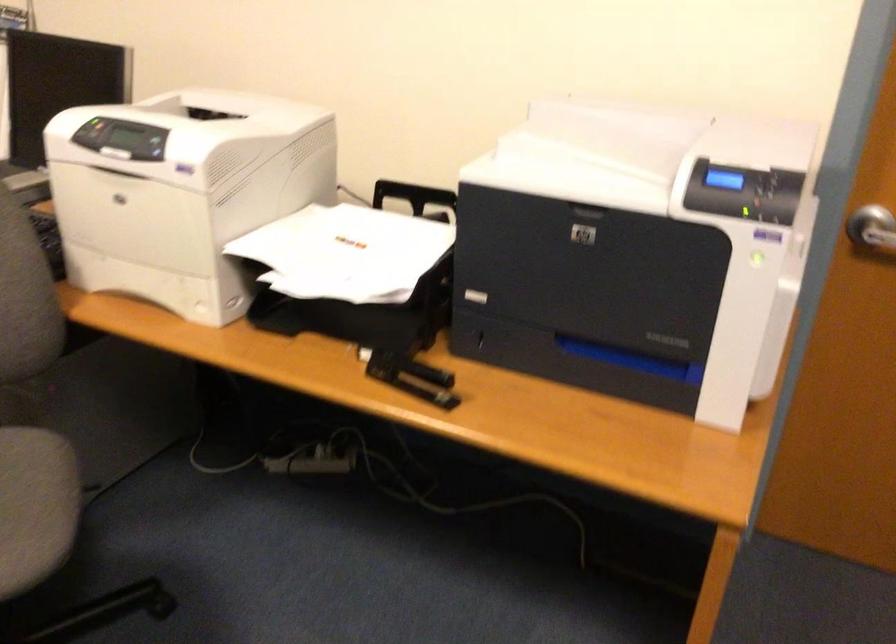
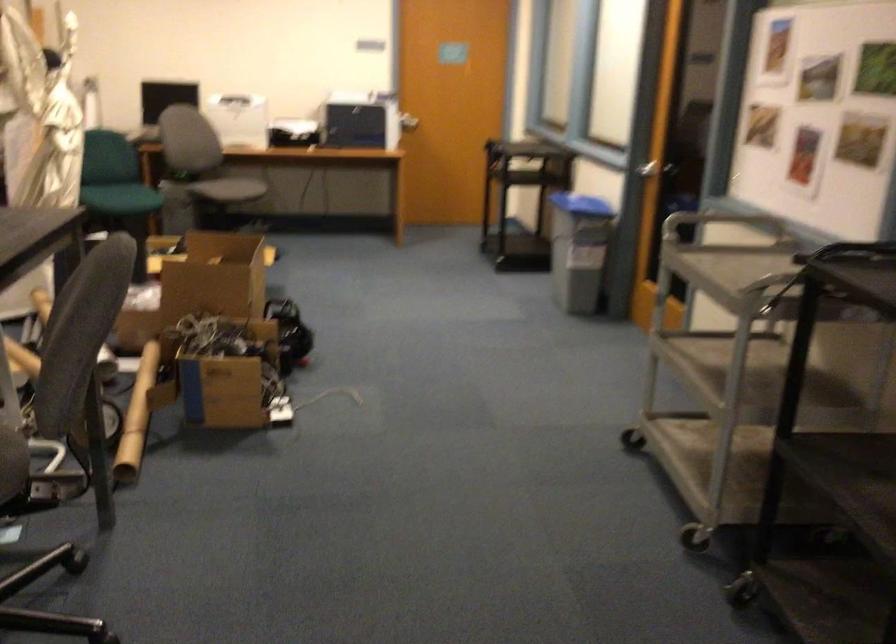
Question: I am providing you with two images of the same scene from different viewpoints. Which of the following objects are not visible in image2?

Choices:
 (A) silver door handle
 (B) chair sitting surface
 (C) green chair sitting surface
 (D) magenta trash can

Answer: (B)